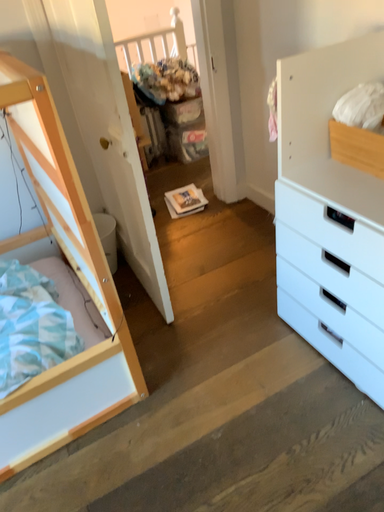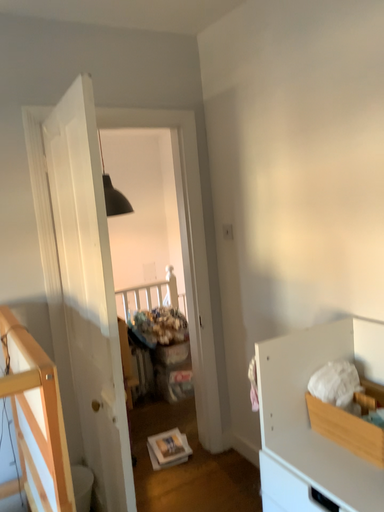
Question: How did the camera likely rotate when shooting the video?

Choices:
 (A) rotated upward
 (B) rotated downward

Answer: (A)